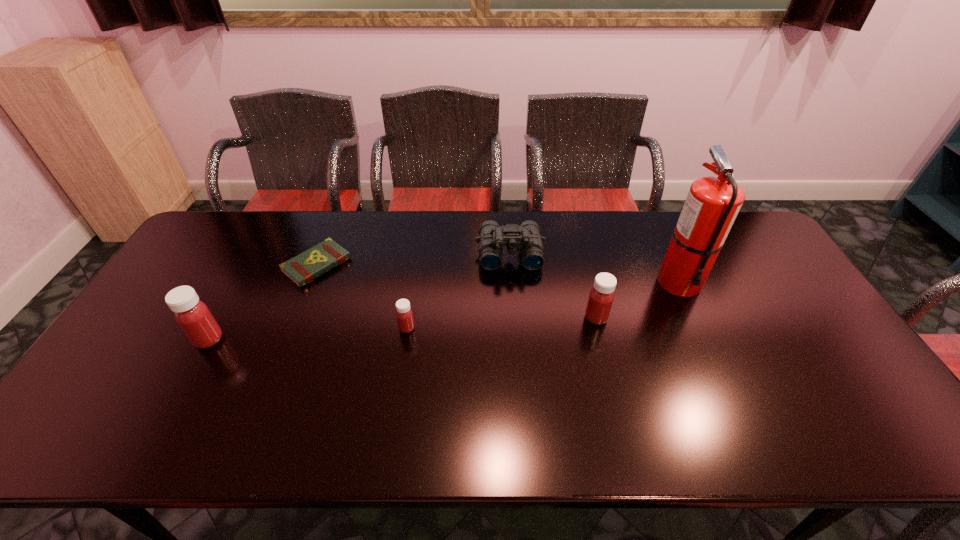
Observe the arrangement of all medicines in the image. To keep them evenly spaced, where would you place another medicine on the right? Please locate a free space. Please provide its 2D coordinates. Your answer should be formatted as a tuple, i.e. [(x, y)], where the tuple contains the x and y coordinates of a point satisfying the conditions above.

[(777, 307)]